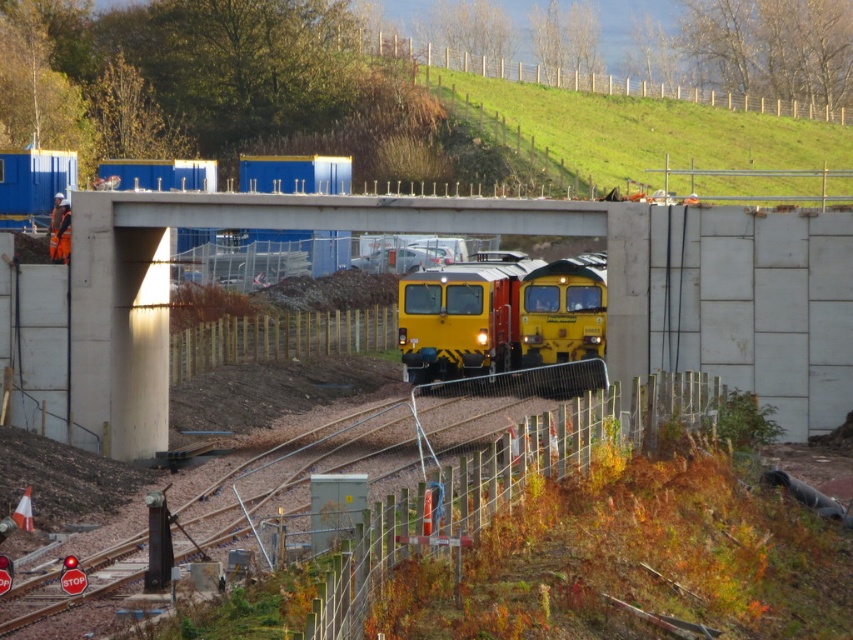
You are a railway worker who needs to place a 10 meter long safety barrier between the concrete at center and the yellow matte train at center. Can you fit the barrier between them without overlapping either object?

The distance between the concrete at center and the yellow matte train at center is 12.00 meters. Since the safety barrier is 10 meters long, it can be placed between them without overlapping either object as there is 2 meters of extra space.

You are a surveyor standing at the point marked by the coordinates point (650,134). Looking around, what is the most prominent feature directly in front of you?

The point (650,134) corresponds to green grass at upper center, so the most prominent feature directly in front of you would be the green grass at upper center.